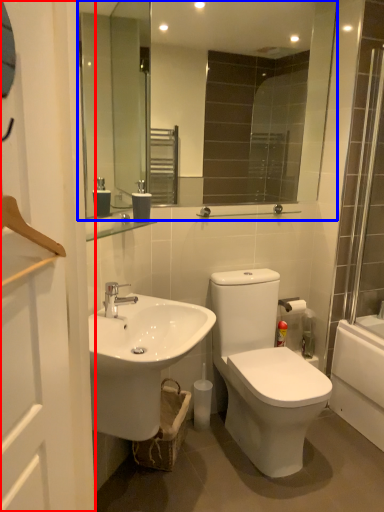
Question: Which object is closer to the camera taking this photo, screen door (highlighted by a red box) or mirror (highlighted by a blue box)?

Choices:
 (A) screen door
 (B) mirror

Answer: (A)